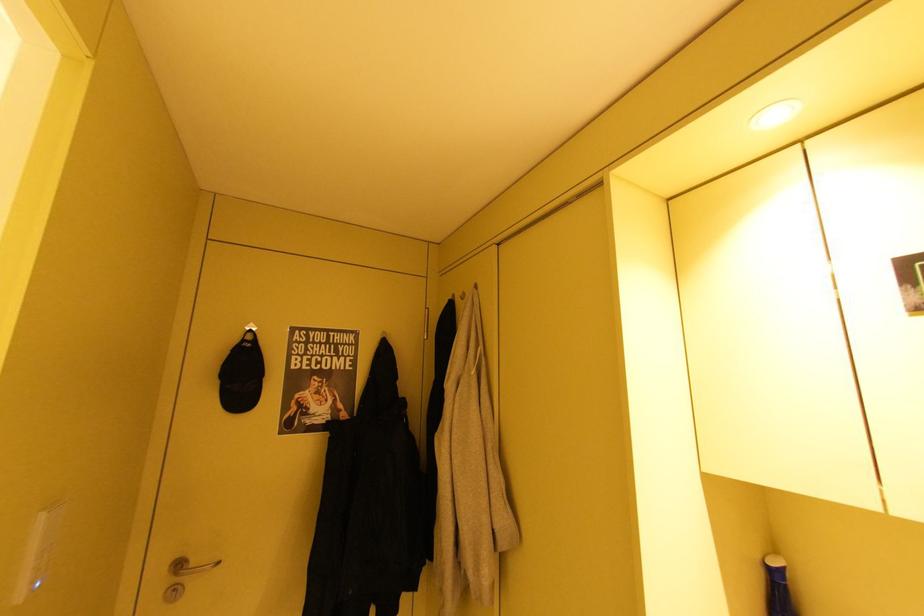
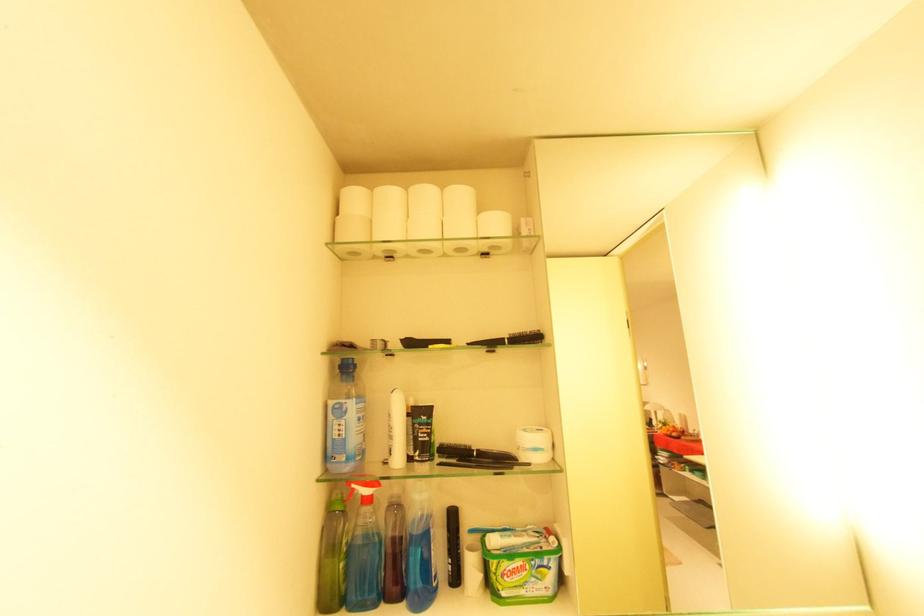
Question: The images are taken continuously from a first-person perspective. In which direction are you moving?

Choices:
 (A) Left
 (B) Right
 (C) Forward
 (D) Backward

Answer: (A)